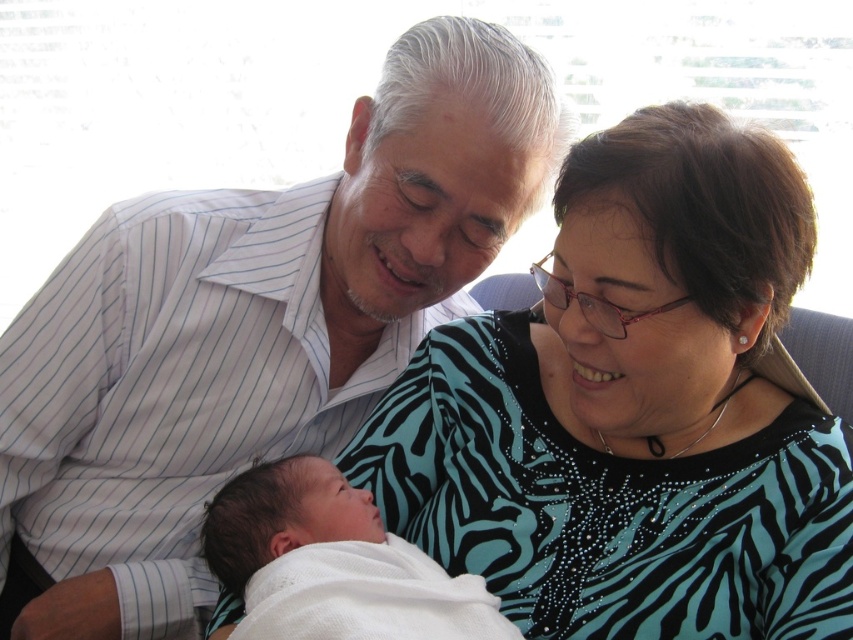
You are a photographer setting up for a family photo. You need to ensure that the zebra print blouse at center and the white soft cloth at center are visible in the shot. Based on their positions, which one should you focus on first to capture both items clearly?

The zebra print blouse at center is above the white soft cloth at center, so focusing on the zebra print blouse at center first will ensure both items are in frame.

You are a photographer trying to capture a closeup of the zebra print blouse at center and the white soft cloth at center. Given that your camera can focus on objects within a 20 cm range, will you be able to capture both items clearly in the same shot?

The zebra print blouse at center is 22.37 centimeters away from the white soft cloth at center, which exceeds the camera focus range of 20 cm. Therefore, you cannot capture both items clearly in the same shot.